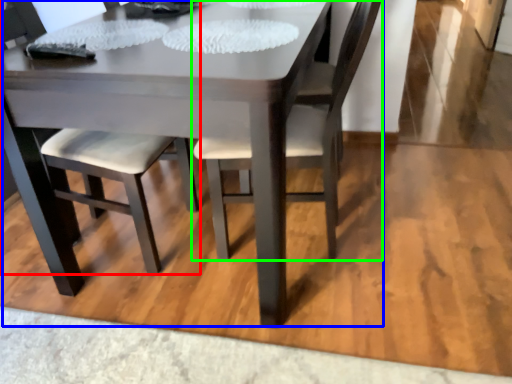
Question: Considering the real-world distances, which object is closest to chair (highlighted by a red box)? kitchen & dining room table (highlighted by a blue box) or chair (highlighted by a green box).

Choices:
 (A) kitchen & dining room table
 (B) chair

Answer: (A)